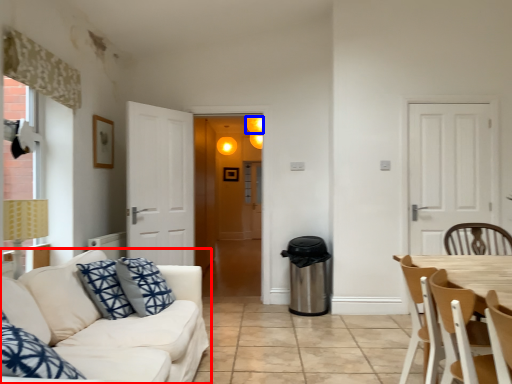
Question: Which object is closer to the camera taking this photo, studio couch (highlighted by a red box) or light (highlighted by a blue box)?

Choices:
 (A) studio couch
 (B) light

Answer: (A)